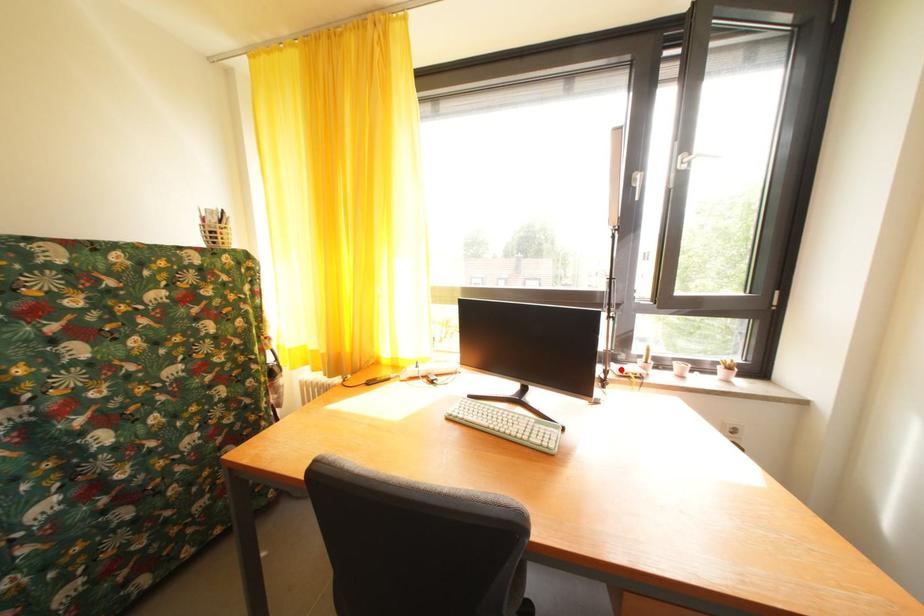
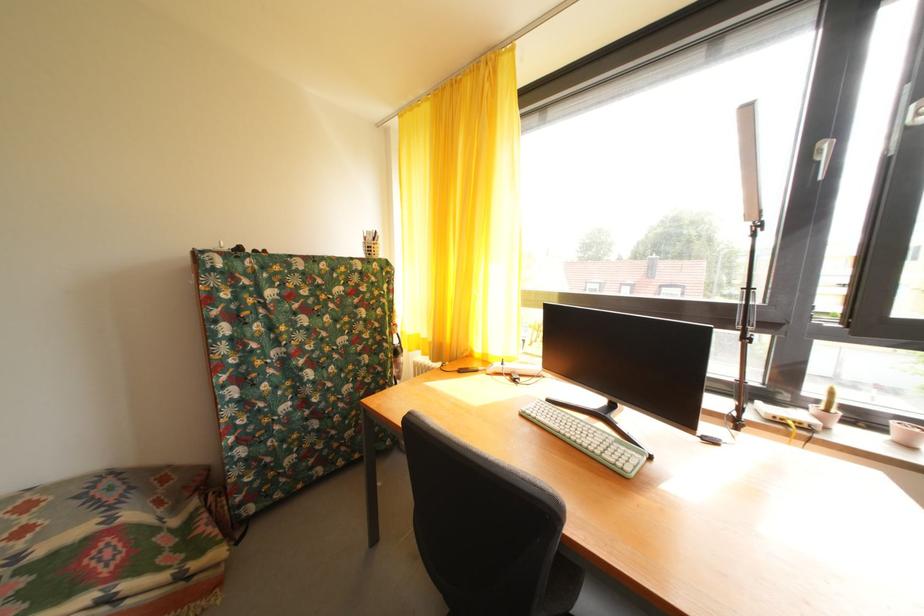
Find the pixel in the second image that matches the highlighted location in the first image.

(768, 408)